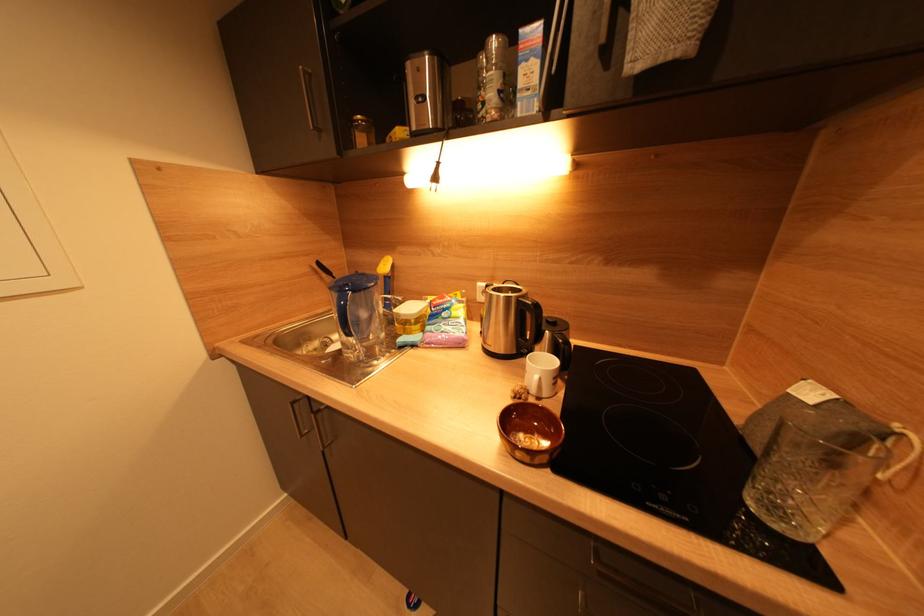
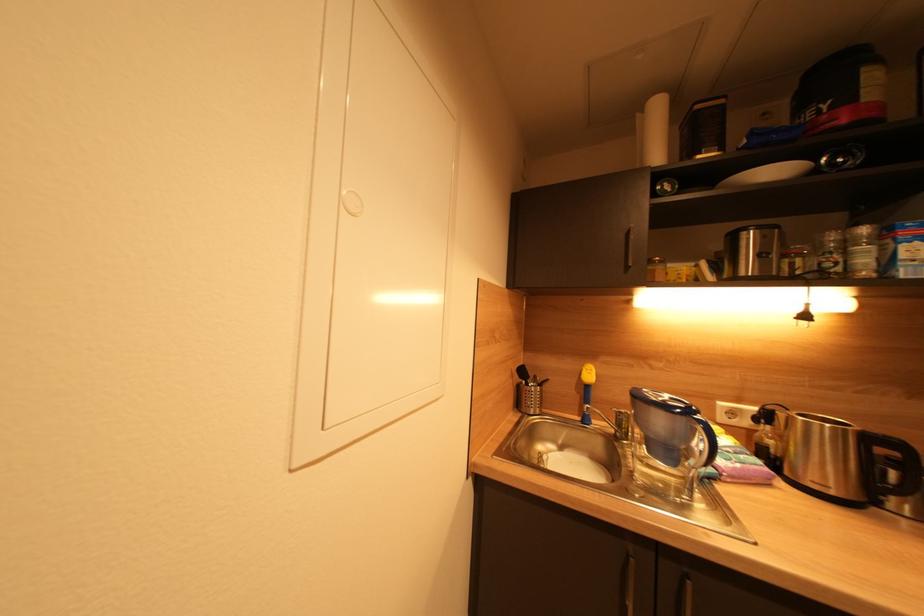
Question: Which direction would the cameraman need to move to produce the second image? Reply with the corresponding letter.

Choices:
 (A) Left
 (B) Right
 (C) Forward
 (D) Backward

Answer: (A)